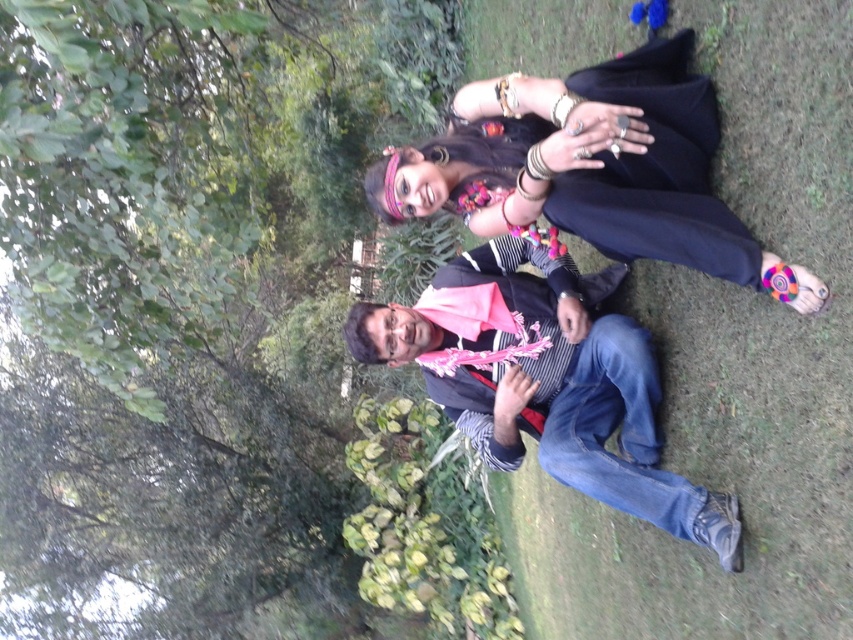
Question: Which point appears farthest from the camera in this image?

Choices:
 (A) (726, 493)
 (B) (691, 196)

Answer: (A)

Question: Does black fabric dress at upper center have a larger size compared to striped fabric scarf at center?

Choices:
 (A) no
 (B) yes

Answer: (A)

Question: Is black fabric dress at upper center below striped fabric scarf at center?

Choices:
 (A) no
 (B) yes

Answer: (A)

Question: Is black fabric dress at upper center smaller than striped fabric scarf at center?

Choices:
 (A) no
 (B) yes

Answer: (B)